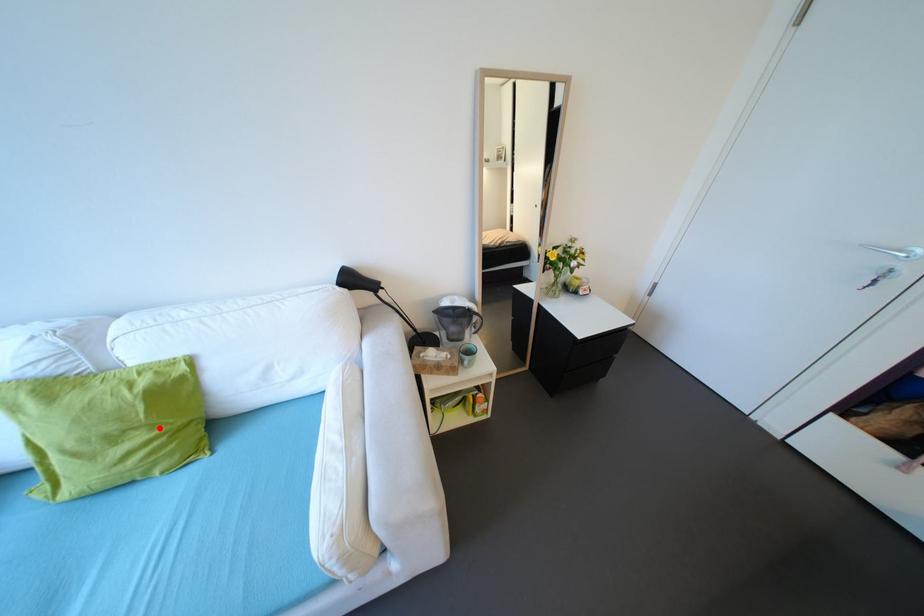
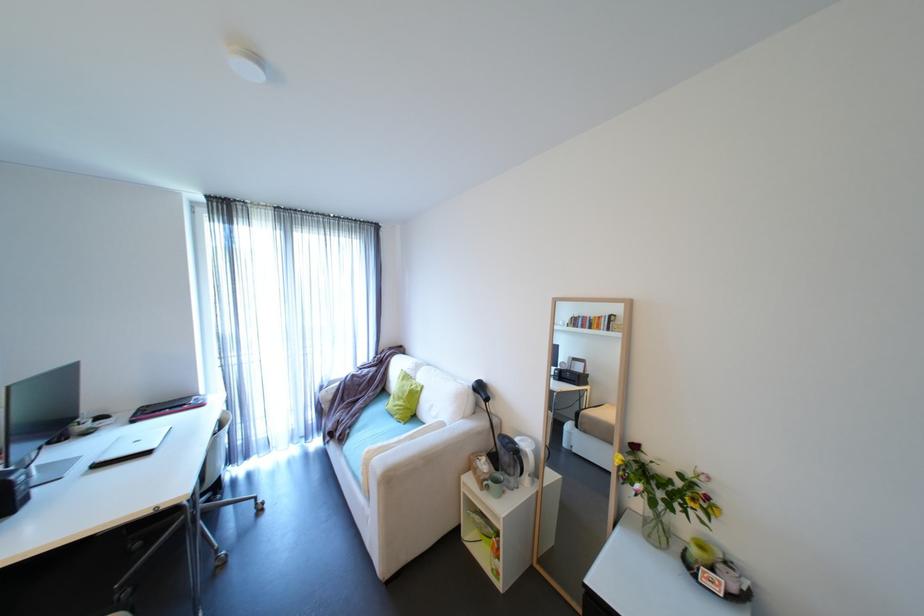
Locate, in the second image, the point that corresponds to the highlighted location in the first image.

(411, 402)